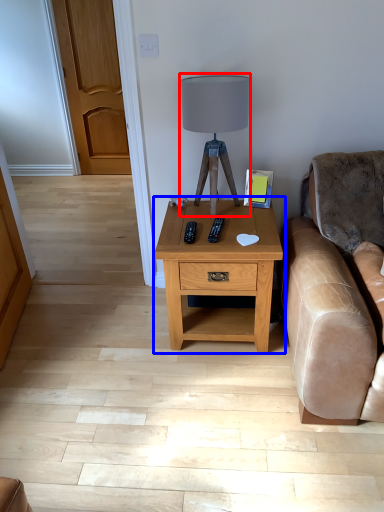
Question: Which of the following is the farthest to the observer, table lamp (highlighted by a red box) or nightstand (highlighted by a blue box)?

Choices:
 (A) table lamp
 (B) nightstand

Answer: (B)